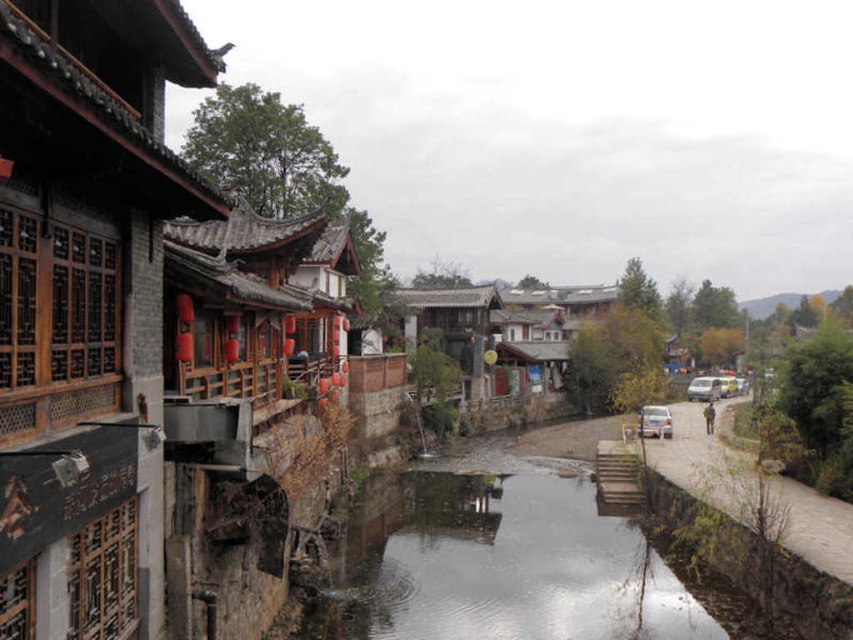
You are a drone operator who needs to capture a closeup shot of the clear concrete river at center. According to the coordinates provided, where should you position the drone to get the best view?

The clear concrete river at center is located at coordinates point (497, 564), so the drone should be positioned directly above this point to capture the best closeup shot.

Based on the photo, you are a delivery person trying to cross the clear concrete river at center with your white matte car at center. Can your car safely drive over the river?

The clear concrete river at center might be wider than white matte car at center, so it is uncertain if the car can safely cross. The driver should check the river width before proceeding.

You are standing at the entrance of the village and want to cross the clear concrete river at center to reach the white matte car at center. If the car is parked 10 meters away from you, can you walk directly to the car without crossing the river?

The clear concrete river at center is 11.46 meters away from white matte car at center. Since the car is only 10 meters away from you, you can reach the car before reaching the river, so you don